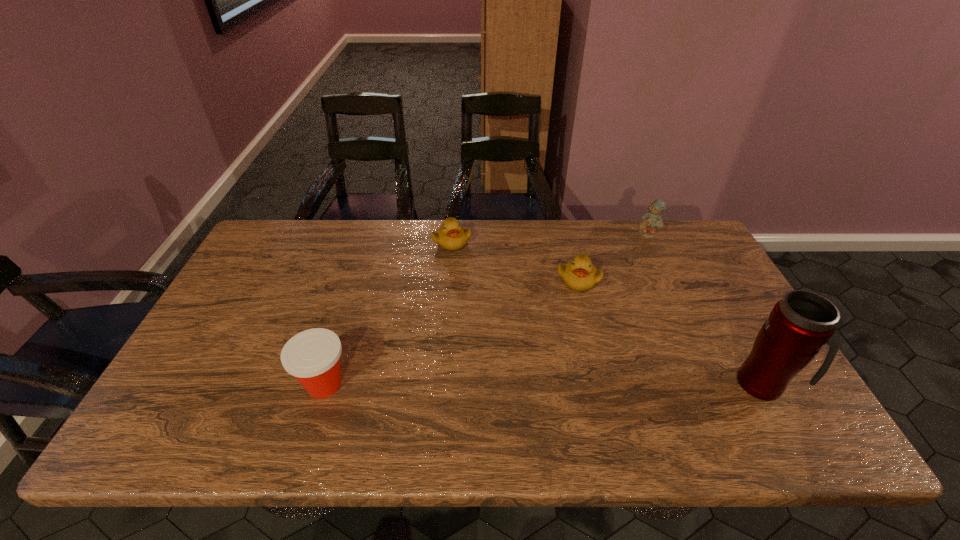
The image size is (960, 540). I want to click on free space between the left duckling and the fourth object from left to right, so click(x=549, y=238).

This screenshot has height=540, width=960. I want to click on blank region between the right duckling and the second object from left to right, so click(x=515, y=261).

Where is `object that stands as the fourth closest to the farther duckling`? object that stands as the fourth closest to the farther duckling is located at coordinates (802, 322).

Point out which object is positioned as the nearest to the farther duckling. Please provide its 2D coordinates. Your answer should be formatted as a tuple, i.e. [(x, y)], where the tuple contains the x and y coordinates of a point satisfying the conditions above.

[(580, 275)]

Where is `free region that satisfies the following two spatial constraints: 1. on the back side of the left duckling; 2. on the left side of the second object from right to left`? The width and height of the screenshot is (960, 540). free region that satisfies the following two spatial constraints: 1. on the back side of the left duckling; 2. on the left side of the second object from right to left is located at coordinates (452, 234).

In order to click on vacant region that satisfies the following two spatial constraints: 1. on the front side of the thermos bottle; 2. on the side with the handle of the third farthest object in this screenshot , I will do `click(604, 384)`.